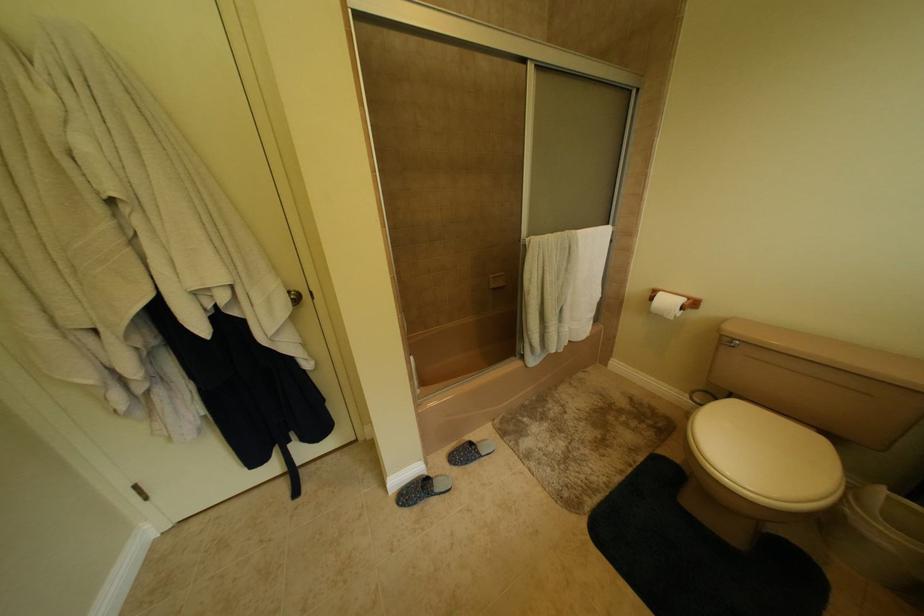
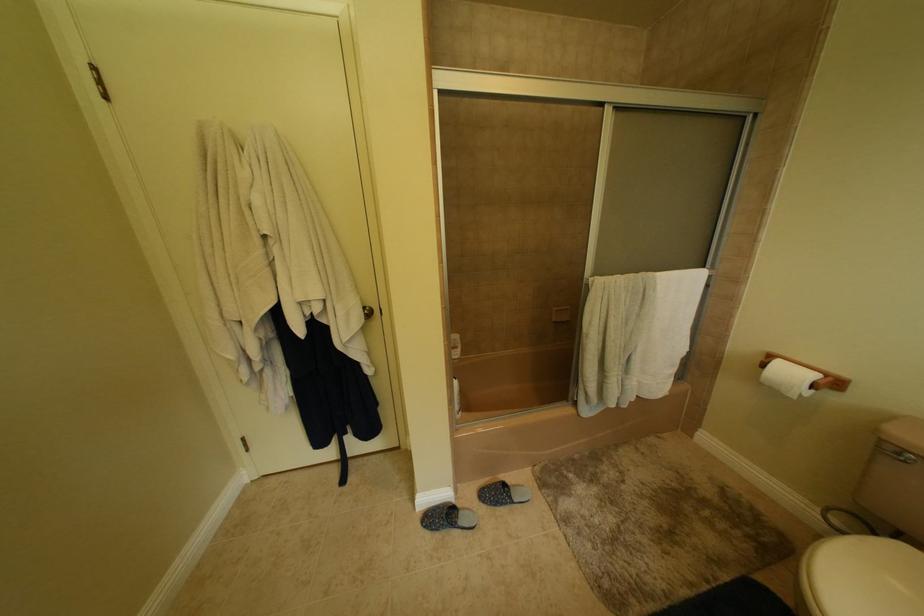
Question: The images are taken continuously from a first-person perspective. In which direction is your viewpoint rotating?

Choices:
 (A) Left
 (B) Right
 (C) Up
 (D) Down

Answer: (A)